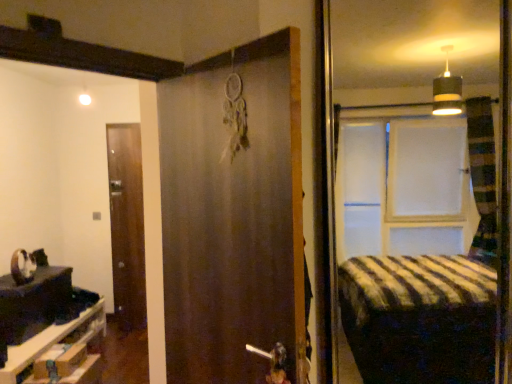
Question: From a real-world perspective, is wooden drawer at lower left beneath brown wooden door at left, which is counted as the 2th door, starting from the right?

Choices:
 (A) no
 (B) yes

Answer: (B)

Question: Can you confirm if wooden drawer at lower left is bigger than brown wooden door at left, which is counted as the first door, starting from the left?

Choices:
 (A) no
 (B) yes

Answer: (B)

Question: Considering the relative sizes of wooden drawer at lower left and brown wooden door at left, which is counted as the first door, starting from the left, in the image provided, is wooden drawer at lower left wider than brown wooden door at left, which is counted as the first door, starting from the left,?

Choices:
 (A) no
 (B) yes

Answer: (B)

Question: Is wooden drawer at lower left thinner than brown wooden door at left, which is counted as the first door, starting from the left?

Choices:
 (A) yes
 (B) no

Answer: (B)

Question: From a real-world perspective, is wooden drawer at lower left on brown wooden door at left, positioned as the 1th door in back-to-front order?

Choices:
 (A) yes
 (B) no

Answer: (B)

Question: Is brown wooden door at left, positioned as the 1th door in back-to-front order, wider or thinner than wooden drawer at lower left?

Choices:
 (A) wide
 (B) thin

Answer: (B)

Question: In the image, is brown wooden door at left, marked as the second door in a front-to-back arrangement, on the left side or the right side of wooden drawer at lower left?

Choices:
 (A) right
 (B) left

Answer: (A)

Question: Is brown wooden door at left, which is counted as the first door, starting from the left, in front of or behind wooden drawer at lower left in the image?

Choices:
 (A) front
 (B) behind

Answer: (B)

Question: Considering the positions of point 118,238 and point 74,370, is point 118,238 closer or farther from the camera than point 74,370?

Choices:
 (A) closer
 (B) farther

Answer: (B)

Question: In the image, is wooden drawer at lower left positioned in front of or behind brown wooden door at left, marked as the second door in a front-to-back arrangement?

Choices:
 (A) front
 (B) behind

Answer: (A)

Question: From the image's perspective, is wooden drawer at lower left positioned above or below brown wooden door at left, which is counted as the 2th door, starting from the right?

Choices:
 (A) below
 (B) above

Answer: (A)

Question: Is wooden drawer at lower left to the left or to the right of brown wooden door at left, positioned as the 1th door in back-to-front order, in the image?

Choices:
 (A) left
 (B) right

Answer: (A)

Question: Considering the positions of point (89, 340) and point (131, 127), is point (89, 340) closer or farther from the camera than point (131, 127)?

Choices:
 (A) farther
 (B) closer

Answer: (B)

Question: In terms of height, does brown matte door at center, positioned as the 2th door in back-to-front order, look taller or shorter compared to brown wooden door at left, which is counted as the first door, starting from the left?

Choices:
 (A) short
 (B) tall

Answer: (A)

Question: Do you think brown matte door at center, the 1th door in the right-to-left sequence, is within brown wooden door at left, marked as the second door in a front-to-back arrangement, or outside of it?

Choices:
 (A) inside
 (B) outside

Answer: (B)